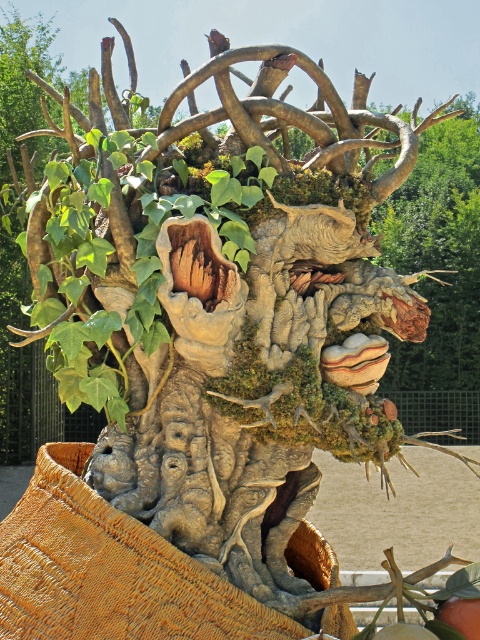
You are an artist analyzing the sculpture. You notice a point at coordinates (462, 616). Based on the sculpture description, what object is located at this point?

The point at coordinates (462, 616) corresponds to the green matte fruit at center.

You are an artist planning to place a small sculpture on the table in front of the leather textured basket at lower left and the green matte fruit at lower center. Which object should you place the sculpture on to ensure it is stable and won

The leather textured basket at lower left is much taller than the green matte fruit at lower center, so placing the sculpture on the leather textured basket at lower left would provide a more stable base due to its height and sturdiness.